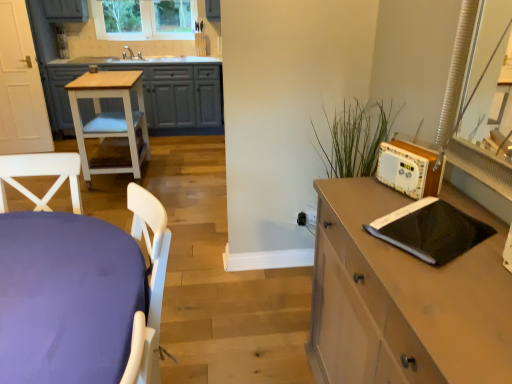
Identify the location of vacant space underneath black matte notebook at right (from a real-world perspective). (428, 232).